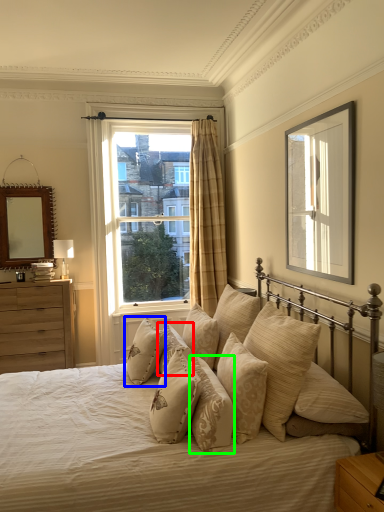
Question: Estimate the real-world distances between objects in this image. Which object is closer to pillow (highlighted by a red box), pillow (highlighted by a blue box) or pillow (highlighted by a green box)?

Choices:
 (A) pillow
 (B) pillow

Answer: (A)